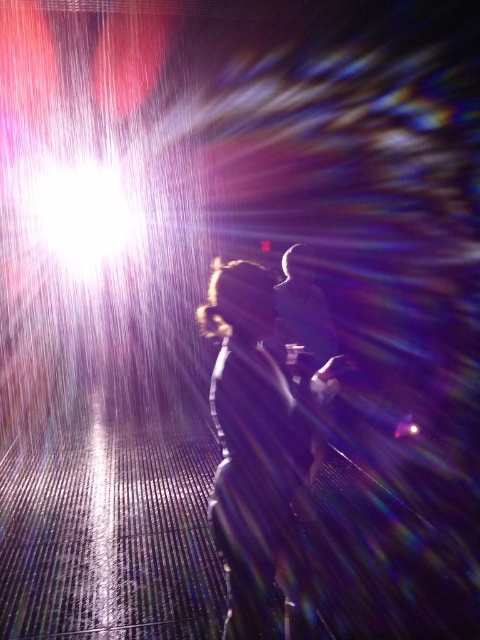
Does dark hair at center appear on the right side of smooth black suit at center?

Incorrect, dark hair at center is not on the right side of smooth black suit at center.

Who is more distant from viewer, (223, 364) or (276, 298)?

The point (276, 298) is behind.

This screenshot has width=480, height=640. I want to click on dark hair at center, so click(256, 456).